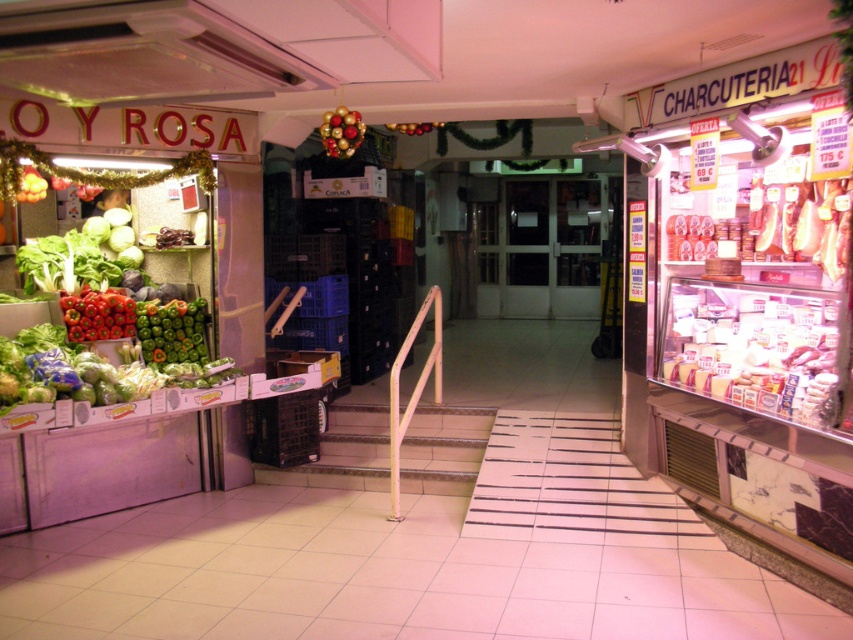
Is point (135, 324) positioned after point (403, 131)?

No.

Which is in front, point (186, 358) or point (427, 125)?

Point (186, 358)

Is point (201, 348) less distant than point (410, 131)?

Yes, point (201, 348) is closer to viewer.

Locate an element on the screen. This screenshot has height=640, width=853. green matte bell peppers at left is located at coordinates (170, 330).

Does green matte bell peppers at left have a greater width compared to red matte bell peppers at left?

Indeed, green matte bell peppers at left has a greater width compared to red matte bell peppers at left.

Can you confirm if green matte bell peppers at left is bigger than red matte bell peppers at left?

Incorrect, green matte bell peppers at left is not larger than red matte bell peppers at left.

Does point (152, 332) lie behind point (108, 316)?

Yes, it is.

At what (x,y) coordinates should I click in order to perform the action: click on green matte bell peppers at left. Please return your answer as a coordinate pair (x, y). The image size is (853, 640). Looking at the image, I should click on pos(170,330).

Is the position of shiny metallic ornaments at center less distant than that of glossy red apples at center?

Yes, it is in front of glossy red apples at center.

Does point (335, 154) lie in front of point (425, 128)?

Yes, point (335, 154) is in front of point (425, 128).

This screenshot has height=640, width=853. What do you see at coordinates (341, 131) in the screenshot?
I see `shiny metallic ornaments at center` at bounding box center [341, 131].

Find the location of a particular element. The width and height of the screenshot is (853, 640). shiny metallic ornaments at center is located at coordinates (341, 131).